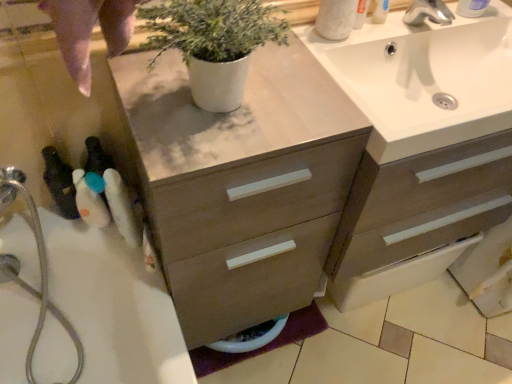
What are the coordinates of `free spot to the left of silver metallic faucet at upper right` in the screenshot? It's located at (375, 33).